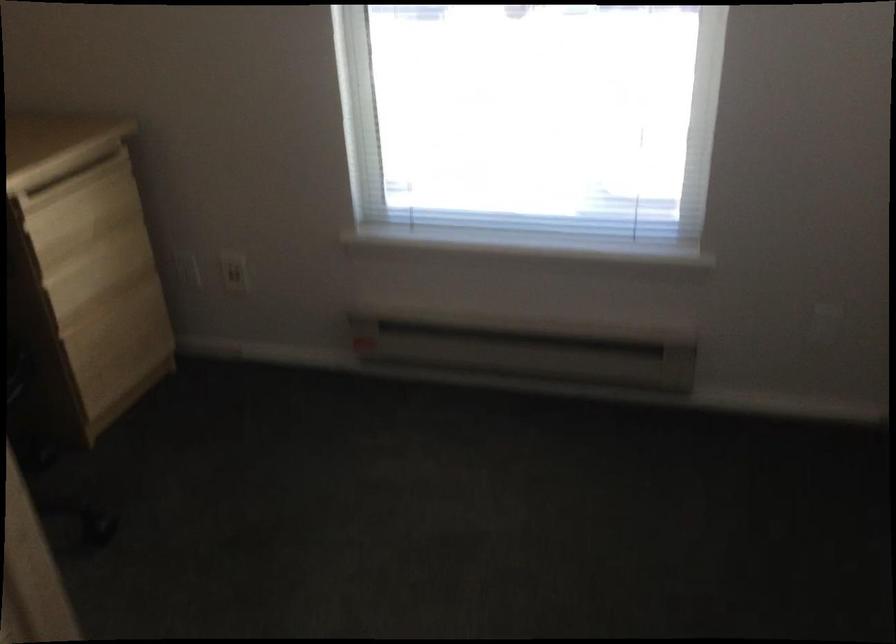
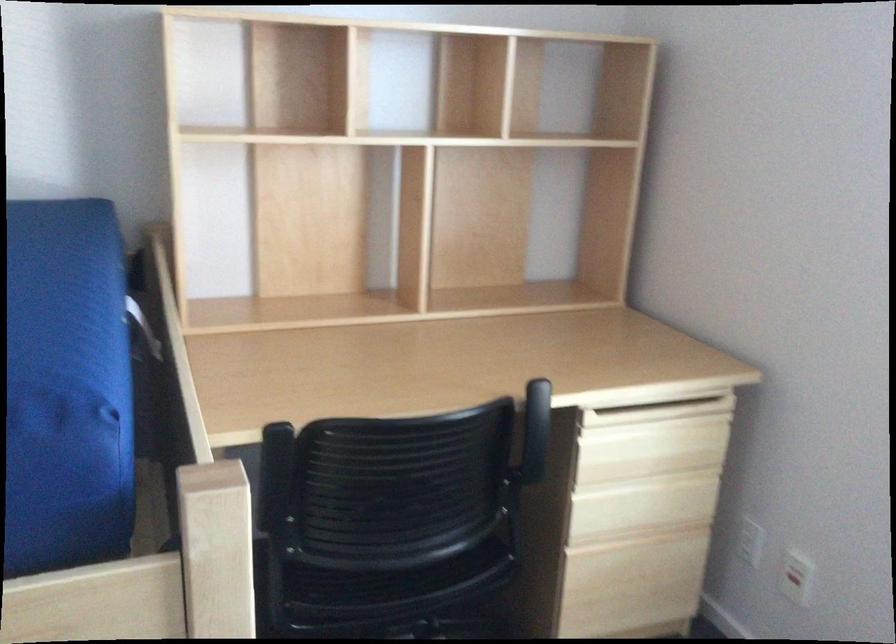
Question: The camera is either moving clockwise (left) or counter-clockwise (right) around the object. The first image is from the beginning of the video and the second image is from the end. Is the camera moving left or right when shooting the video?

Choices:
 (A) Left
 (B) Right

Answer: (B)